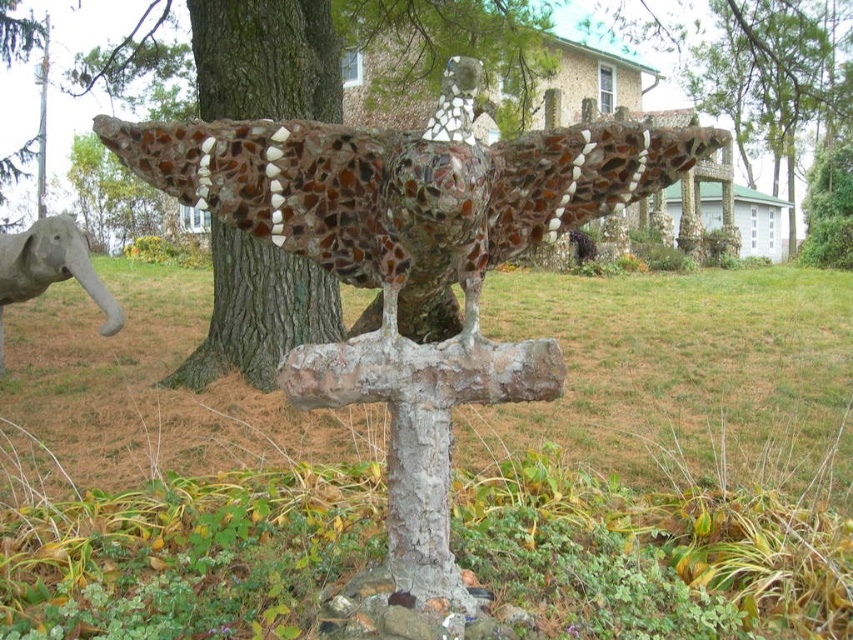
Looking at this image, what object is located at the coordinates point (x=410, y=259)?

The point (x=410, y=259) corresponds to the mosaic glass bird at center.

You are an artist planning to place a new sculpture in the outdoor scene. The existing mosaic glass bird at center is at coordinates 0.405, 0.482. If you want to place a new sculpture 0.1 units to the right and 0.05 units above the current bird, where would the new sculpture be positioned?

The new sculpture would be positioned at coordinates (453,323) by adding 0.1 to the x and 0.05 to the y coordinates of the mosaic glass bird at center.